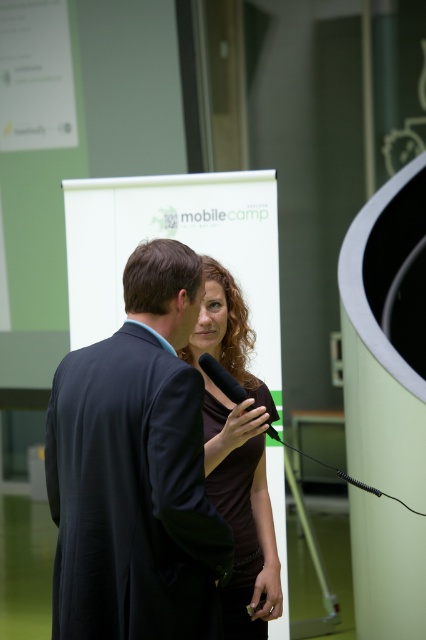
You are organizing a photo shoot and need to ensure that the dark blue suit at center and the black matte microphone at center will fit within a 1.2 meter wide backdrop. Given their sizes, can both items be placed side by side without overlapping?

The dark blue suit at center is wider than the black matte microphone at center. Since the total width of both items combined would exceed 1.2 meters, they cannot be placed side by side without overlapping on the backdrop.

You are organizing an event and need to place a decorative stand between the brown matte dress at center and the black matte microphone at center. Which object should the stand be placed closer to if it needs to be near the larger item?

The stand should be placed closer to the brown matte dress at center since it has a larger size compared to the black matte microphone at center.